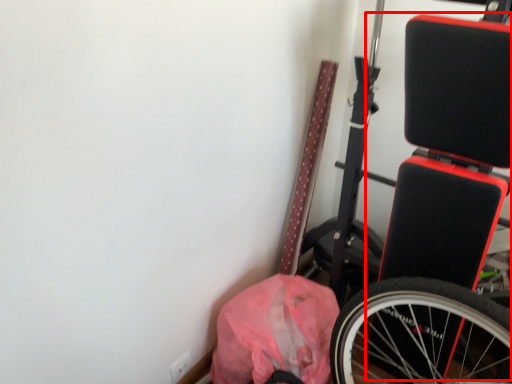
Question: Observing the image, what is the correct spatial positioning of wide (annotated by the red box) in reference to material?

Choices:
 (A) left
 (B) right

Answer: (B)